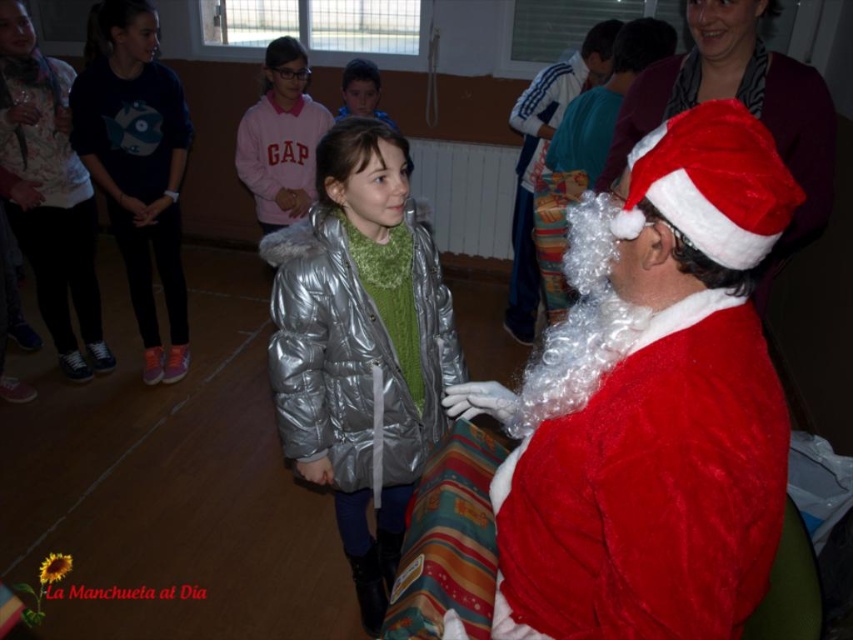
Question: Which point appears farthest from the camera in this image?

Choices:
 (A) (666, 140)
 (B) (119, 148)
 (C) (543, 115)

Answer: (C)

Question: Which point is farther to the camera?

Choices:
 (A) (315, 307)
 (B) (136, 164)
 (C) (575, 65)

Answer: (C)

Question: From the image, what is the correct spatial relationship of velvet red santa claus at right in relation to matte blue fish at left?

Choices:
 (A) below
 (B) above

Answer: (A)

Question: Does matte blue fish at left have a greater width compared to pink fleece sweater at upper center?

Choices:
 (A) yes
 (B) no

Answer: (A)

Question: Which of these objects is positioned farthest from the matte blue fish at left?

Choices:
 (A) velvet red santa claus at right
 (B) shiny silver jacket at center

Answer: (A)

Question: Does shiny silver jacket at center have a smaller size compared to matte blue fish at left?

Choices:
 (A) yes
 (B) no

Answer: (A)